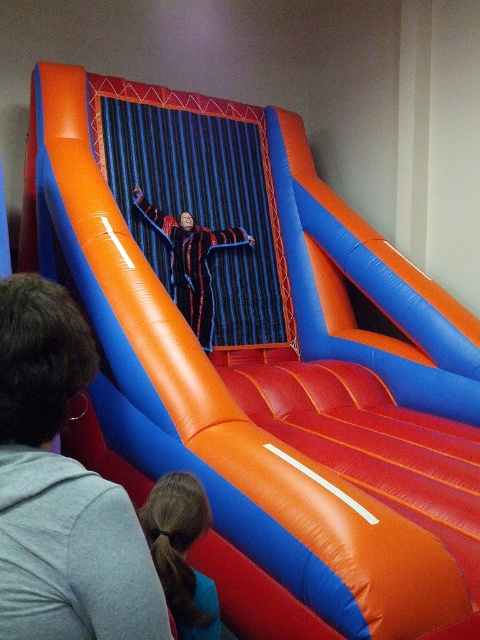
You are a photographer trying to capture a clear shot of the matte black jacket at upper center and the smooth brown hair at lower center. However, you notice that one object is blocking the view of the other. Which object is covering part of the other?

The matte black jacket at upper center is positioned over smooth brown hair at lower center, so the matte black jacket at upper center is covering part of the smooth brown hair at lower center.

In the image of the vibrant inflatable slide, there are two people partially visible in the foreground. The first is a person wearing a matte black jacket at upper center, and the second is someone in a black textured jumpsuit at center. From the perspective of an observer looking at the slide, which of these two individuals is positioned more to the left?

The black textured jumpsuit at center is positioned more to the left because the matte black jacket at upper center is to its right.

You are standing at the bottom of the inflatable slide and looking up. There is a point marked at coordinates (60,490). What object is located at this point?

The point at coordinates (60,490) marks the location of the matte black jacket at upper center.